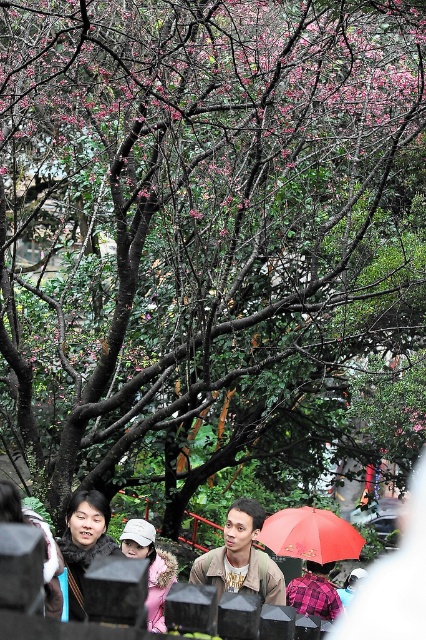
You are standing at the point marked by the coordinates point (310, 534) in the image. What object is directly in front of you?

The point (310, 534) indicates the red matte umbrella at center, so the object directly in front of you is the red matte umbrella at center.